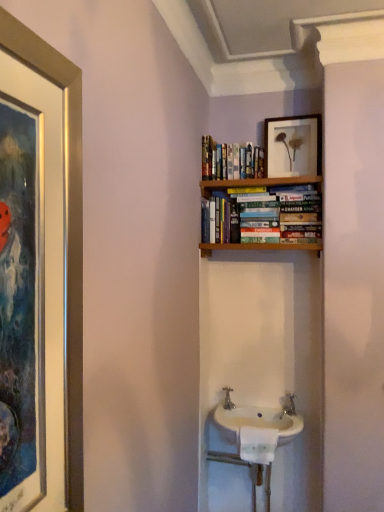
Question: Considering the relative sizes of hardcover books at upper center and white ceramic sink at center in the image provided, is hardcover books at upper center smaller than white ceramic sink at center?

Choices:
 (A) yes
 (B) no

Answer: (A)

Question: Is hardcover books at upper center in front of white ceramic sink at center?

Choices:
 (A) yes
 (B) no

Answer: (B)

Question: Considering the relative sizes of hardcover books at upper center and white ceramic sink at center in the image provided, is hardcover books at upper center bigger than white ceramic sink at center?

Choices:
 (A) yes
 (B) no

Answer: (B)

Question: Could you tell me if hardcover books at upper center is facing white ceramic sink at center?

Choices:
 (A) yes
 (B) no

Answer: (B)

Question: Is white ceramic sink at center a part of hardcover books at upper center?

Choices:
 (A) no
 (B) yes

Answer: (A)

Question: Is hardcover books at upper center facing away from white ceramic sink at center?

Choices:
 (A) yes
 (B) no

Answer: (B)

Question: Is hardcover books at upper center next to matte wooden picture frame at upper center and touching it?

Choices:
 (A) no
 (B) yes

Answer: (A)

Question: Is hardcover books at upper center positioned far away from matte wooden picture frame at upper center?

Choices:
 (A) yes
 (B) no

Answer: (B)

Question: Can you confirm if hardcover books at upper center is bigger than matte wooden picture frame at upper center?

Choices:
 (A) no
 (B) yes

Answer: (B)

Question: Does hardcover books at upper center have a greater width compared to matte wooden picture frame at upper center?

Choices:
 (A) no
 (B) yes

Answer: (B)

Question: Can you confirm if hardcover books at upper center is positioned to the left of matte wooden picture frame at upper center?

Choices:
 (A) no
 (B) yes

Answer: (B)

Question: Is hardcover books at upper center not within matte wooden picture frame at upper center?

Choices:
 (A) no
 (B) yes

Answer: (B)

Question: Considering the relative sizes of hardcover books at upper center and silver metallic tap at center in the image provided, is hardcover books at upper center bigger than silver metallic tap at center?

Choices:
 (A) no
 (B) yes

Answer: (B)